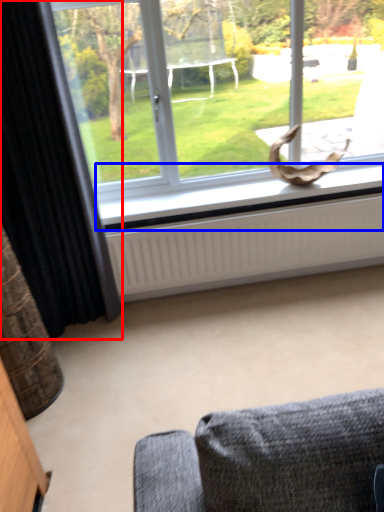
Question: Among these objects, which one is farthest to the camera, curtain (highlighted by a red box) or window sill (highlighted by a blue box)?

Choices:
 (A) curtain
 (B) window sill

Answer: (B)